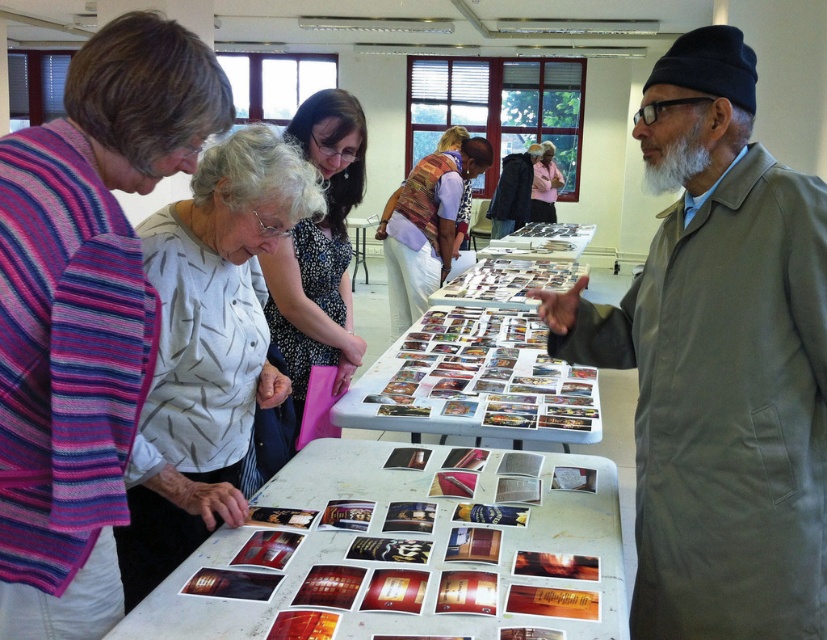
Question: Which of the following is the farthest from the observer?

Choices:
 (A) (350, 189)
 (B) (268, 621)
 (C) (526, 200)
 (D) (663, 74)

Answer: (C)

Question: Is patterned fabric vest at center positioned in front of dark gray woolen jacket at center?

Choices:
 (A) yes
 (B) no

Answer: (A)

Question: Can you confirm if white paper table at center is smaller than pink fabric at center?

Choices:
 (A) no
 (B) yes

Answer: (B)

Question: Which object appears farthest from the camera in this image?

Choices:
 (A) white dotted shirt at upper left
 (B) floral dress at center
 (C) patterned fabric vest at center
 (D) white plastic table at center

Answer: (D)

Question: Which is nearer to the floral dress at center?

Choices:
 (A) patterned fabric vest at center
 (B) white paper at center
 (C) gray matte coat at right
 (D) pink fabric at center

Answer: (B)

Question: Is white paper at center wider than white glossy table at center?

Choices:
 (A) no
 (B) yes

Answer: (A)